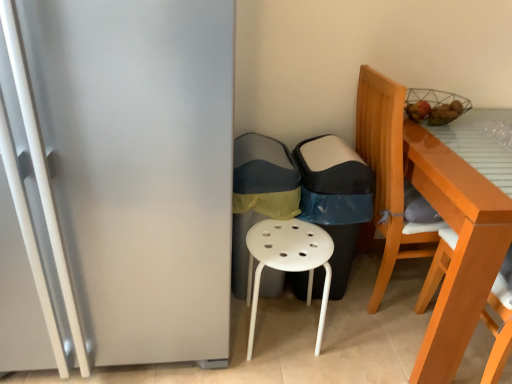
Question: Does gray fabric trash can at center, positioned as the first garbage in left-to-right order, have a greater height compared to satin silver fridge at left?

Choices:
 (A) yes
 (B) no

Answer: (B)

Question: Can you confirm if gray fabric trash can at center, positioned as the 2th garbage in right-to-left order, is positioned to the right of satin silver fridge at left?

Choices:
 (A) no
 (B) yes

Answer: (B)

Question: From a real-world perspective, does gray fabric trash can at center, positioned as the first garbage in left-to-right order, sit lower than satin silver fridge at left?

Choices:
 (A) yes
 (B) no

Answer: (A)

Question: Is gray fabric trash can at center, positioned as the first garbage in left-to-right order, further to camera compared to satin silver fridge at left?

Choices:
 (A) no
 (B) yes

Answer: (B)

Question: From the image's perspective, is gray fabric trash can at center, positioned as the 2th garbage in right-to-left order, over satin silver fridge at left?

Choices:
 (A) no
 (B) yes

Answer: (A)

Question: From the image's perspective, relative to light brown wooden chair at right, the 2th chair in the left-to-right sequence, is satin silver fridge at left above or below?

Choices:
 (A) below
 (B) above

Answer: (B)

Question: Is satin silver fridge at left taller or shorter than light brown wooden chair at right, the 1th chair in the right-to-left sequence?

Choices:
 (A) tall
 (B) short

Answer: (A)

Question: Does point (214, 117) appear closer or farther from the camera than point (488, 380)?

Choices:
 (A) farther
 (B) closer

Answer: (B)

Question: Would you say satin silver fridge at left is inside or outside light brown wooden chair at right, the 2th chair in the left-to-right sequence?

Choices:
 (A) inside
 (B) outside

Answer: (B)

Question: Considering the positions of gray fabric trash can at center, positioned as the first garbage in left-to-right order, and satin silver fridge at left in the image, is gray fabric trash can at center, positioned as the first garbage in left-to-right order, wider or thinner than satin silver fridge at left?

Choices:
 (A) thin
 (B) wide

Answer: (A)

Question: Choose the correct answer: Is gray fabric trash can at center, positioned as the first garbage in left-to-right order, inside satin silver fridge at left or outside it?

Choices:
 (A) outside
 (B) inside

Answer: (A)

Question: From a real-world perspective, relative to satin silver fridge at left, is gray fabric trash can at center, positioned as the 2th garbage in right-to-left order, vertically above or below?

Choices:
 (A) below
 (B) above

Answer: (A)

Question: Considering the positions of point (246, 278) and point (218, 352), is point (246, 278) closer or farther from the camera than point (218, 352)?

Choices:
 (A) closer
 (B) farther

Answer: (B)

Question: Is satin silver fridge at left bigger or smaller than gray fabric trash can at center, positioned as the 2th garbage in right-to-left order?

Choices:
 (A) small
 (B) big

Answer: (B)

Question: Is satin silver fridge at left to the left or to the right of gray fabric trash can at center, positioned as the first garbage in left-to-right order, in the image?

Choices:
 (A) right
 (B) left

Answer: (B)